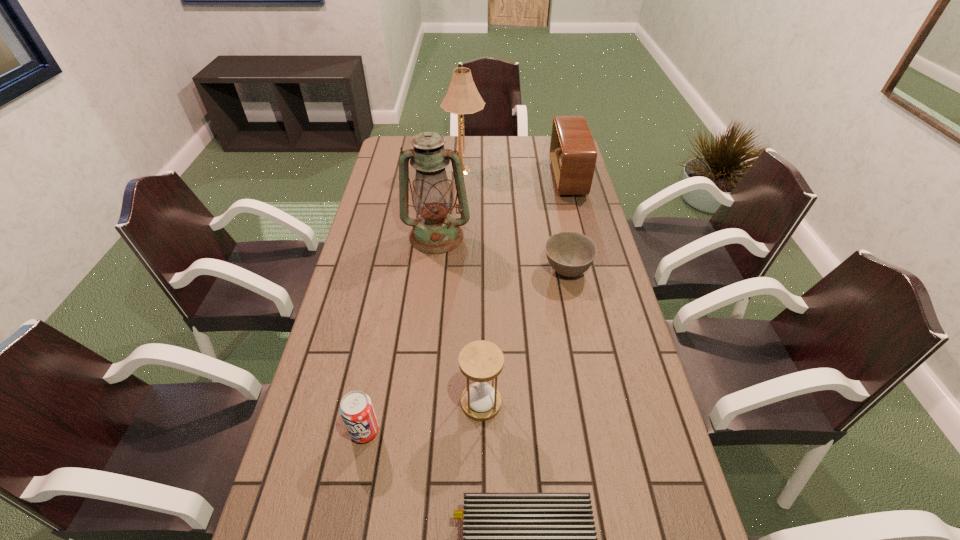
You are a GUI agent. You are given a task and a screenshot of the screen. Output one action in this format:
    pyautogui.click(x=<x>, y=<y>)
    Task: Click on the lampshade
    The height and width of the screenshot is (540, 960).
    Given the screenshot: What is the action you would take?
    click(x=462, y=97)

Locate an element on the screen. oil lamp is located at coordinates (434, 232).

The image size is (960, 540). I want to click on radio receiver, so click(x=573, y=154).

Locate an element on the screen. hourglass is located at coordinates (481, 361).

Where is `the third shortest object`? This screenshot has height=540, width=960. the third shortest object is located at coordinates (356, 409).

Where is `bowl`? This screenshot has width=960, height=540. bowl is located at coordinates (569, 253).

Find the location of a particular element. The height and width of the screenshot is (540, 960). free space located 0.210m on the front of the lampshade is located at coordinates (463, 212).

Locate an element on the screen. The width and height of the screenshot is (960, 540). blank space located on the right of the oil lamp is located at coordinates (548, 236).

Find the location of `blank space located on the front-facing side of the radio receiver`. blank space located on the front-facing side of the radio receiver is located at coordinates (538, 178).

I want to click on vacant region located 0.230m on the front-facing side of the radio receiver, so click(x=496, y=178).